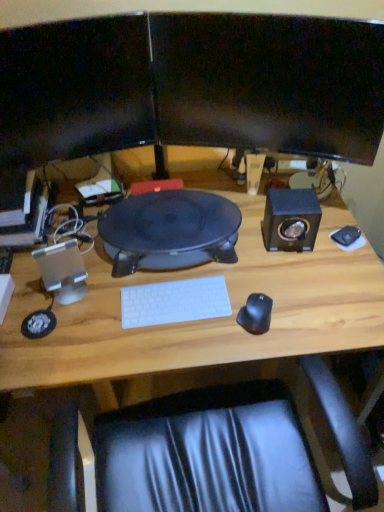
Identify the location of free space to the back side of black matte speaker at right, which is counted as the first speaker, starting from the right. (258, 202).